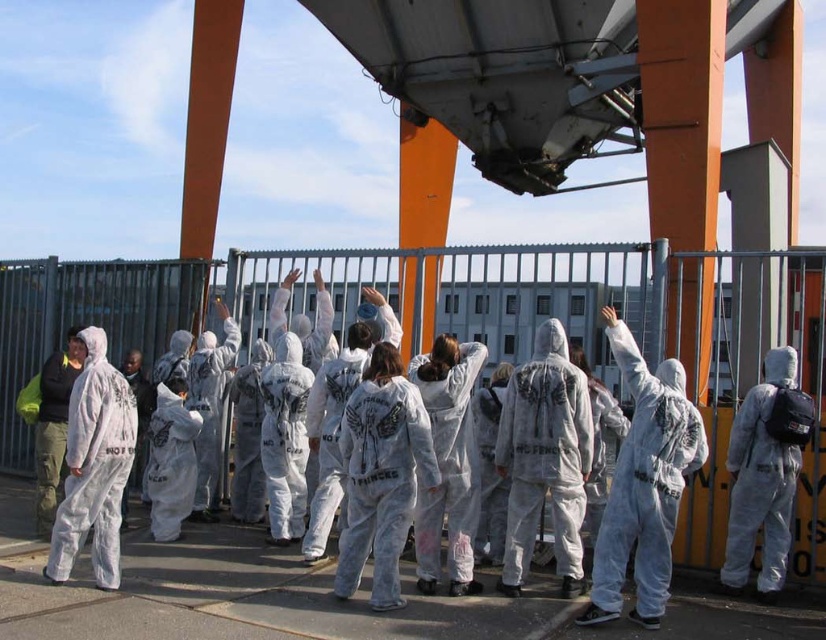
Question: Considering the real-world distances, which object is closest to the white matte hazmat suit at right?

Choices:
 (A) white matte jumpsuit at center
 (B) dark green fabric jacket at left

Answer: (A)

Question: Is white matte jumpsuit at center to the left of white matte hazmat suit at right from the viewer's perspective?

Choices:
 (A) yes
 (B) no

Answer: (A)

Question: Is white matte jumpsuit at center wider than dark green fabric jacket at left?

Choices:
 (A) no
 (B) yes

Answer: (A)

Question: In this image, where is white matte jumpsuit at center located relative to dark green fabric jacket at left?

Choices:
 (A) left
 (B) right

Answer: (B)

Question: Which point appears closest to the camera in this image?

Choices:
 (A) (746, 552)
 (B) (46, 467)
 (C) (575, 438)

Answer: (C)

Question: Which of these objects is positioned farthest from the white matte hazmat suit at right?

Choices:
 (A) dark green fabric jacket at left
 (B) white matte jumpsuit at center

Answer: (A)